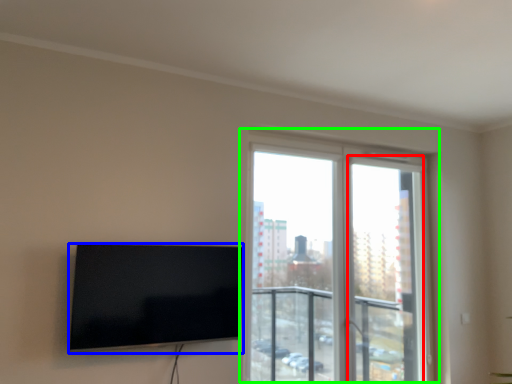
Question: Based on their relative distances, which object is farther from screen door (highlighted by a red box)? Choose from television (highlighted by a blue box) and window (highlighted by a green box).

Choices:
 (A) television
 (B) window

Answer: (A)